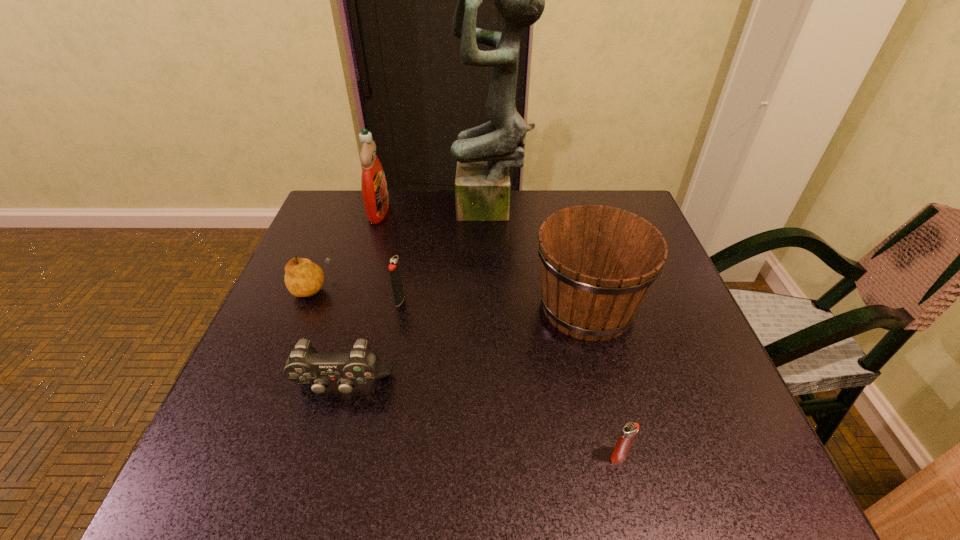
Image resolution: width=960 pixels, height=540 pixels. I want to click on free space at the far left corner, so click(x=321, y=215).

Locate an element on the screen. This screenshot has width=960, height=540. free region at the near left corner of the desktop is located at coordinates (223, 487).

Where is `empty space between the pear and the sculpture`? This screenshot has width=960, height=540. empty space between the pear and the sculpture is located at coordinates (401, 249).

Locate an element on the screen. free space between the sixth shortest object and the sculpture is located at coordinates (435, 211).

Where is `free space that is in between the tallest object and the control`? This screenshot has width=960, height=540. free space that is in between the tallest object and the control is located at coordinates (417, 299).

Find the location of `blank region between the tallest object and the fifth shortest object`. blank region between the tallest object and the fifth shortest object is located at coordinates (540, 259).

Where is `free spot between the shortest object and the sculpture`? free spot between the shortest object and the sculpture is located at coordinates (555, 333).

This screenshot has width=960, height=540. Identify the location of free spot between the fifth shortest object and the sculpture. coord(540,259).

The width and height of the screenshot is (960, 540). Find the location of `vacant area that lies between the sixth shortest object and the control`. vacant area that lies between the sixth shortest object and the control is located at coordinates (360, 299).

Where is `empty space between the third tallest object and the pear`? Image resolution: width=960 pixels, height=540 pixels. empty space between the third tallest object and the pear is located at coordinates (448, 298).